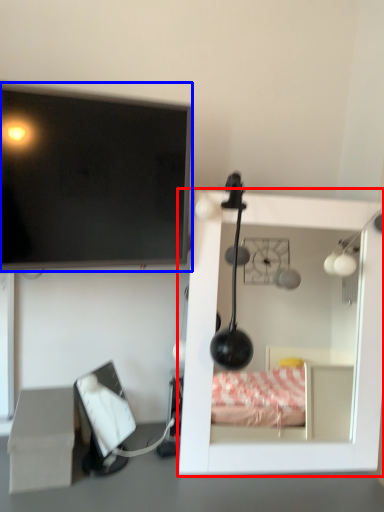
Question: Which point is further to the camera, furniture (highlighted by a red box) or television (highlighted by a blue box)?

Choices:
 (A) furniture
 (B) television

Answer: (A)